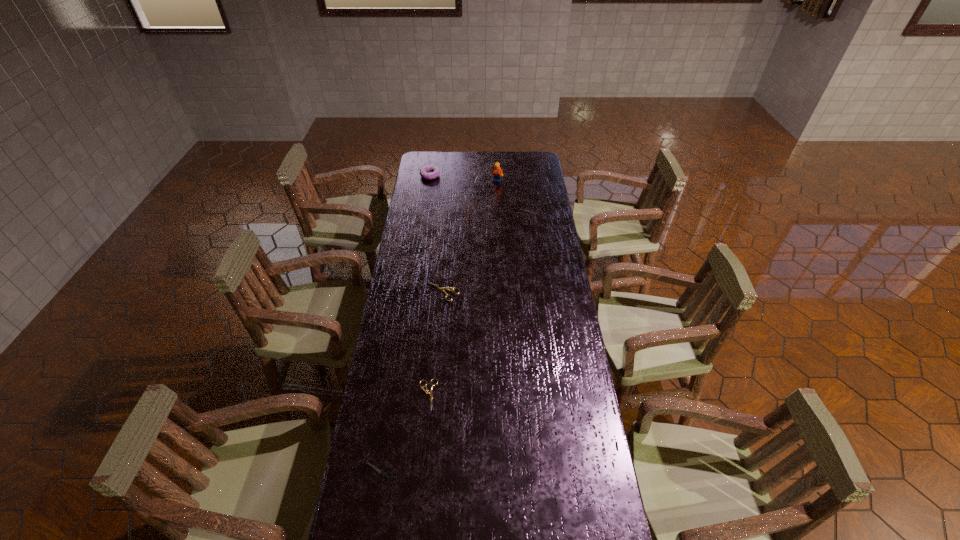
Where is `the tallest object`? The image size is (960, 540). the tallest object is located at coordinates (497, 172).

The image size is (960, 540). In order to click on Lego in this screenshot , I will do `click(497, 172)`.

The height and width of the screenshot is (540, 960). I want to click on sunglasses, so click(x=449, y=201).

Where is `doughnut`? This screenshot has width=960, height=540. doughnut is located at coordinates (424, 171).

Where is `the rightmost object`? This screenshot has height=540, width=960. the rightmost object is located at coordinates [521, 208].

The image size is (960, 540). What are the coordinates of `the bigger black shears` in the screenshot? It's located at (521, 208).

You are a GUI agent. You are given a task and a screenshot of the screen. Output one action in this format:
    pyautogui.click(x=<x>, y=<y>)
    Task: Click on the bigger beige shears
    The width and height of the screenshot is (960, 540).
    Given the screenshot: What is the action you would take?
    pyautogui.click(x=445, y=288)

At what (x,y) coordinates should I click in order to perform the action: click on the second farthest shears. Please return your answer as a coordinate pair (x, y). The width and height of the screenshot is (960, 540). Looking at the image, I should click on (445, 288).

Identify the location of the second nearest object. Image resolution: width=960 pixels, height=540 pixels. (426, 391).

Locate an element on the screen. This screenshot has height=540, width=960. the smaller beige shears is located at coordinates (426, 391).